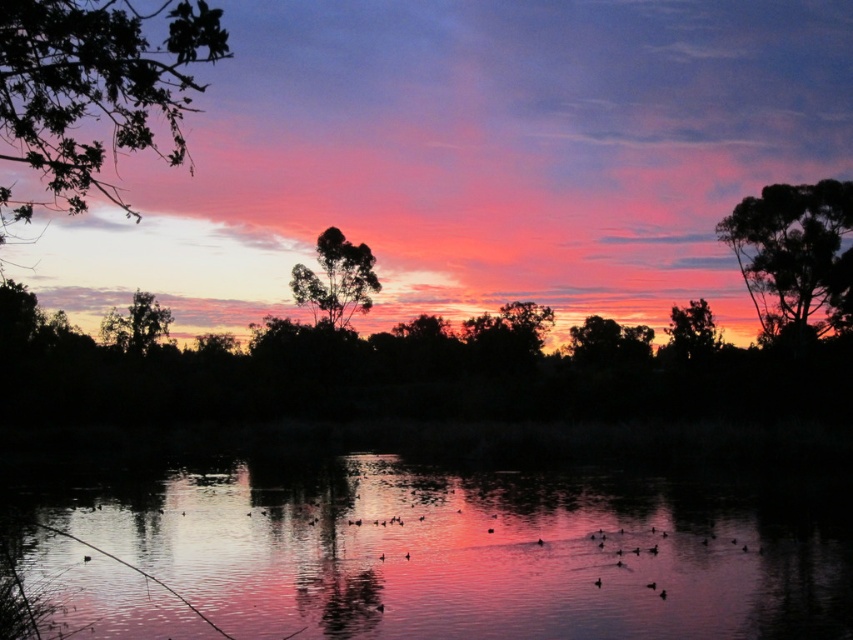
Who is positioned more to the left, green leafy tree at upper left or green leafy tree at upper right?

From the viewer's perspective, green leafy tree at upper left appears more on the left side.

Is green leafy tree at upper left taller than green leafy tree at upper right?

Yes, green leafy tree at upper left is taller than green leafy tree at upper right.

Describe the element at coordinates (94, 90) in the screenshot. I see `green leafy tree at upper left` at that location.

This screenshot has height=640, width=853. I want to click on green leafy tree at upper left, so click(x=94, y=90).

Does silhouette tree at right appear under green leafy tree at upper right?

No, silhouette tree at right is not below green leafy tree at upper right.

Between point (741, 227) and point (691, 301), which one is positioned behind?

Positioned behind is point (691, 301).

You are a GUI agent. You are given a task and a screenshot of the screen. Output one action in this format:
    pyautogui.click(x=<x>, y=<y>)
    Task: Click on the silhouette tree at right
    Image resolution: width=853 pixels, height=640 pixels.
    Given the screenshot: What is the action you would take?
    pyautogui.click(x=793, y=253)

What do you see at coordinates (793, 253) in the screenshot? This screenshot has height=640, width=853. I see `silhouette tree at right` at bounding box center [793, 253].

Is silhouette tree at right further to camera compared to green leafy tree at left?

No, silhouette tree at right is in front of green leafy tree at left.

Who is more forward, (776, 196) or (151, 342)?

Positioned in front is point (776, 196).

Identify the location of silhouette tree at right. (793, 253).